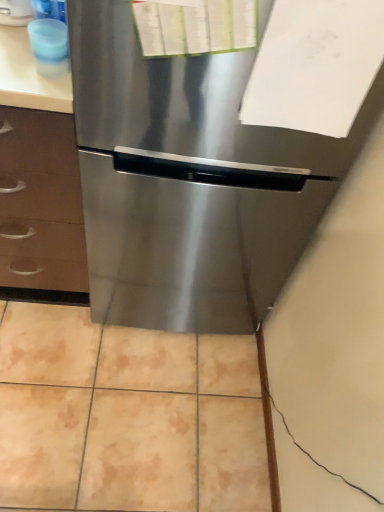
You are a GUI agent. You are given a task and a screenshot of the screen. Output one action in this format:
    pyautogui.click(x=<x>, y=<y>)
    Task: Click on the free space to the left of translucent blue cup at upper left
    The height and width of the screenshot is (512, 384).
    Given the screenshot: What is the action you would take?
    pyautogui.click(x=14, y=57)